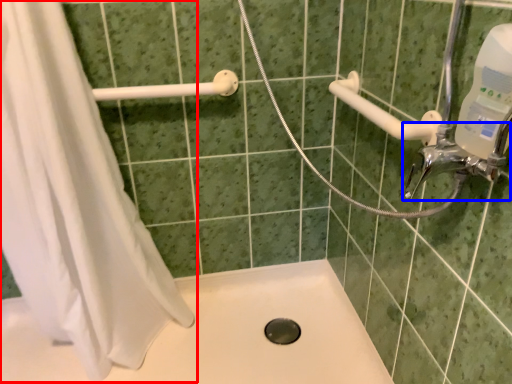
Question: Which object is closer to the camera taking this photo, shower curtain (highlighted by a red box) or tap (highlighted by a blue box)?

Choices:
 (A) shower curtain
 (B) tap

Answer: (B)